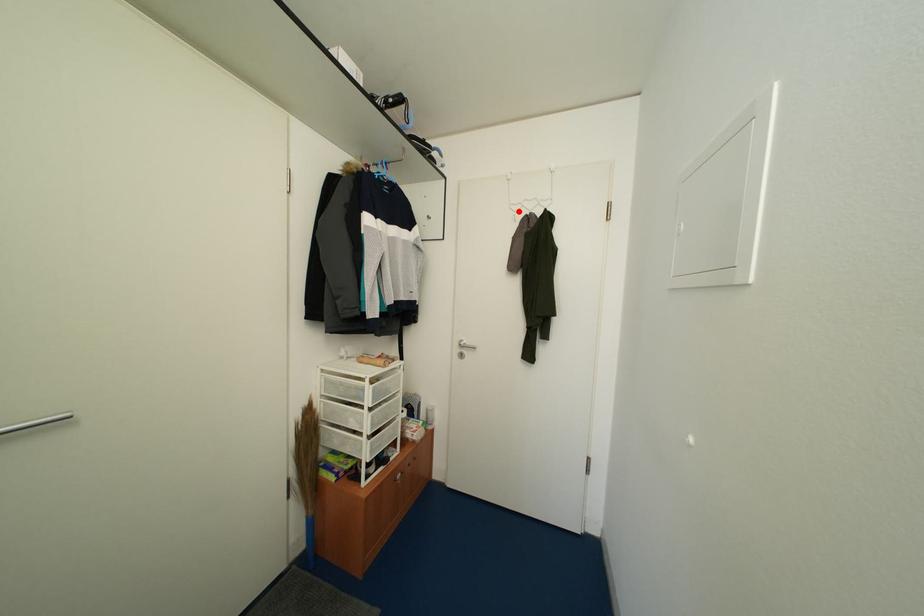
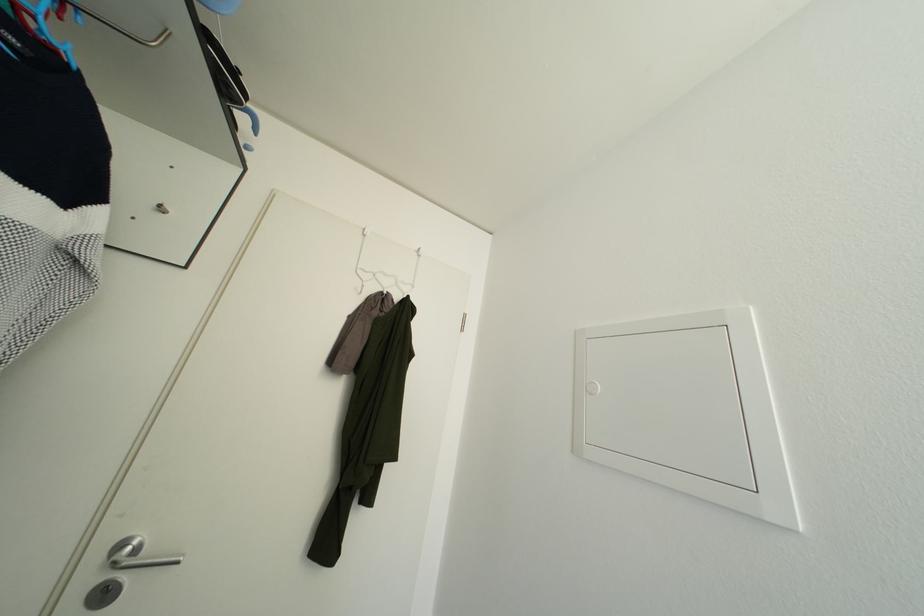
Where in the second image is the point corresponding to the highlighted location from the first image?

(366, 277)